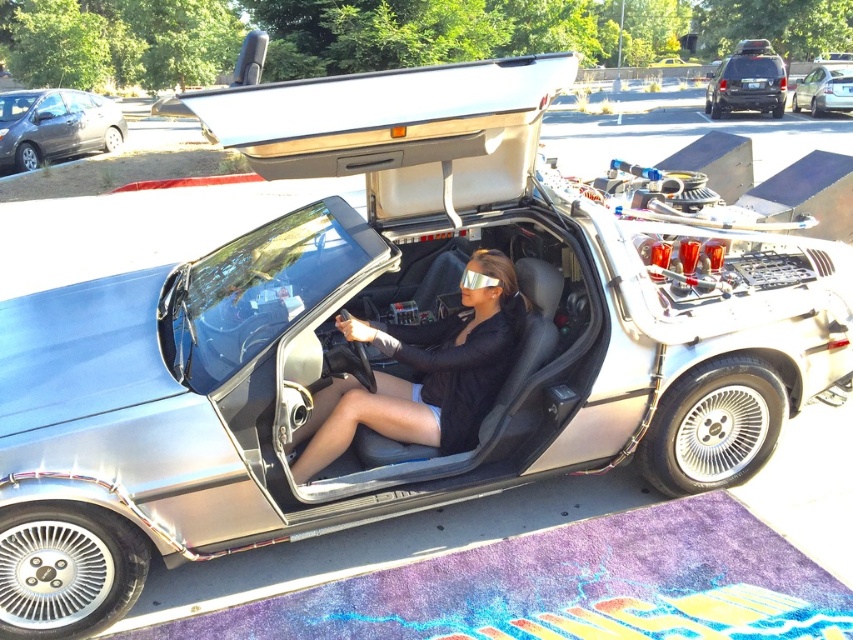
Between point (491, 275) and point (7, 131), which one is positioned in front?

Positioned in front is point (491, 275).

Where is `matte black jacket at center`? This screenshot has width=853, height=640. matte black jacket at center is located at coordinates (422, 376).

Does matte black jacket at center have a greater height compared to black matte suv at upper right?

In fact, matte black jacket at center may be shorter than black matte suv at upper right.

Which is in front, point (349, 339) or point (718, 108)?

Point (349, 339)

Where is `matte black jacket at center`? matte black jacket at center is located at coordinates (422, 376).

Describe the element at coordinates (422, 376) in the screenshot. I see `matte black jacket at center` at that location.

Which is below, matte black jacket at center or silver metallic sedan at upper right?

matte black jacket at center is lower down.

The width and height of the screenshot is (853, 640). Identify the location of matte black jacket at center. (422, 376).